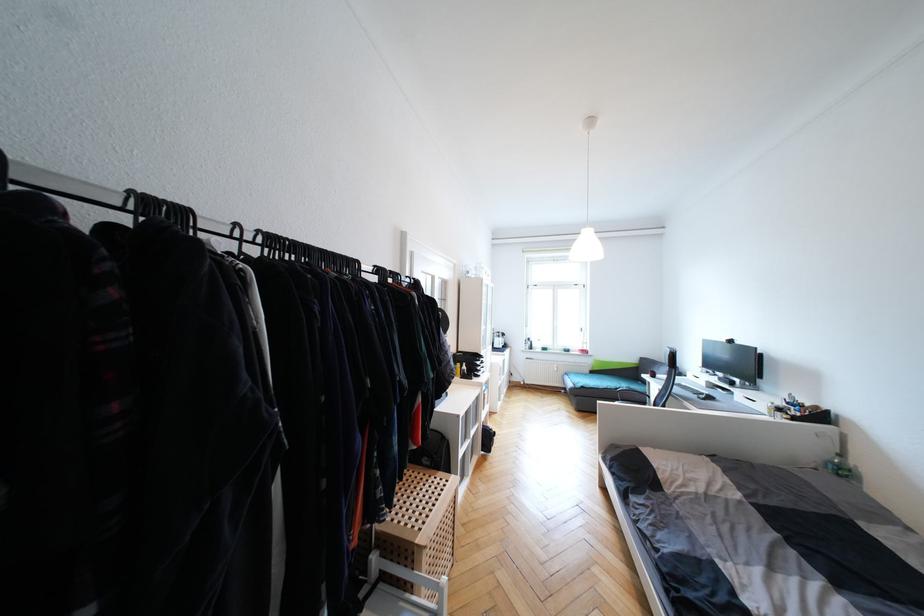
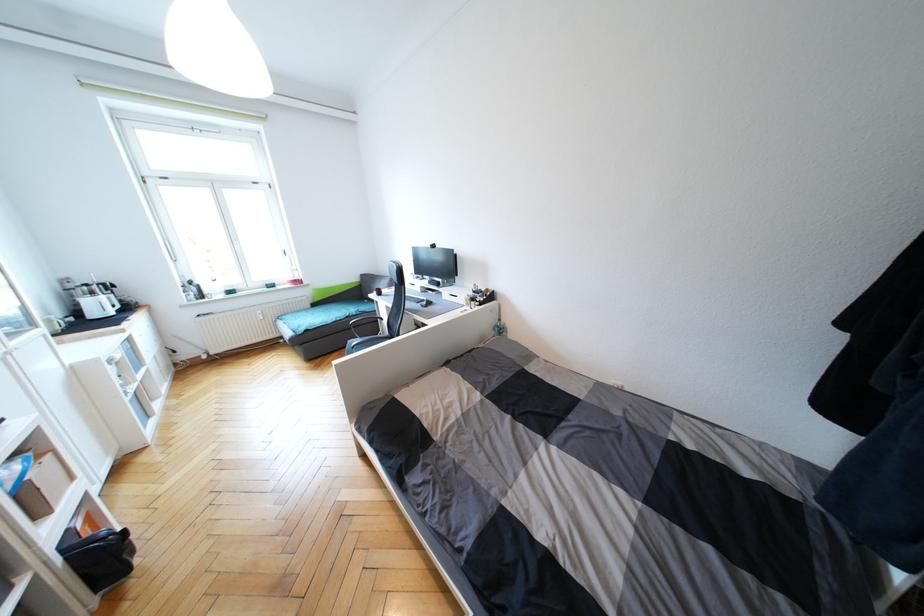
Find the pixel in the second image that matches point (783, 411) in the first image.

(476, 301)